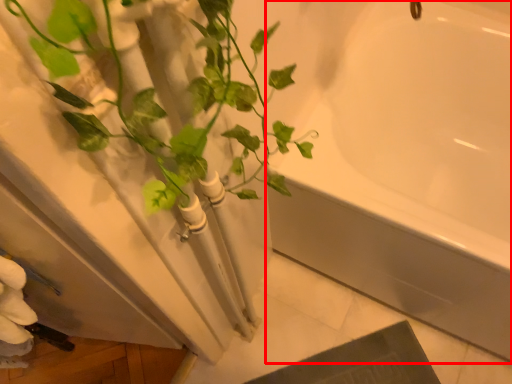
Question: From the image's perspective, considering the relative positions of bathtub (annotated by the red box) and houseplant in the image provided, where is bathtub (annotated by the red box) located with respect to the staircase?

Choices:
 (A) above
 (B) below

Answer: (A)